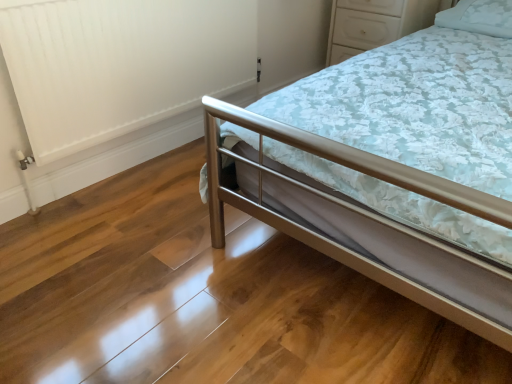
Question: Is white matte radiator at left at the right side of white fabric pillow at upper right?

Choices:
 (A) no
 (B) yes

Answer: (A)

Question: Is white matte radiator at left bigger than white fabric pillow at upper right?

Choices:
 (A) no
 (B) yes

Answer: (B)

Question: Does white matte radiator at left have a greater height compared to white fabric pillow at upper right?

Choices:
 (A) no
 (B) yes

Answer: (B)

Question: From the image's perspective, is white matte radiator at left below white fabric pillow at upper right?

Choices:
 (A) yes
 (B) no

Answer: (A)

Question: From the image's perspective, does white matte radiator at left appear higher than white fabric pillow at upper right?

Choices:
 (A) yes
 (B) no

Answer: (B)

Question: Choose the correct answer: Is white matte radiator at left inside white fabric pillow at upper right or outside it?

Choices:
 (A) outside
 (B) inside

Answer: (A)

Question: Visually, is white matte radiator at left positioned to the left or to the right of white fabric pillow at upper right?

Choices:
 (A) right
 (B) left

Answer: (B)

Question: Considering their positions, is white matte radiator at left located in front of or behind white fabric pillow at upper right?

Choices:
 (A) behind
 (B) front

Answer: (B)

Question: Considering the positions of point (14, 77) and point (482, 8), is point (14, 77) closer or farther from the camera than point (482, 8)?

Choices:
 (A) closer
 (B) farther

Answer: (A)

Question: Is white matte radiator at left wider or thinner than white glossy dresser at upper right?

Choices:
 (A) thin
 (B) wide

Answer: (A)

Question: From the image's perspective, relative to white glossy dresser at upper right, is white matte radiator at left above or below?

Choices:
 (A) below
 (B) above

Answer: (A)

Question: Looking at the image, does white matte radiator at left seem bigger or smaller compared to white glossy dresser at upper right?

Choices:
 (A) big
 (B) small

Answer: (B)

Question: Would you say white matte radiator at left is inside or outside white glossy dresser at upper right?

Choices:
 (A) outside
 (B) inside

Answer: (A)

Question: Which is correct: white glossy dresser at upper right is inside white matte radiator at left, or outside of it?

Choices:
 (A) inside
 (B) outside

Answer: (B)

Question: From the image's perspective, is white glossy dresser at upper right positioned above or below white matte radiator at left?

Choices:
 (A) above
 (B) below

Answer: (A)